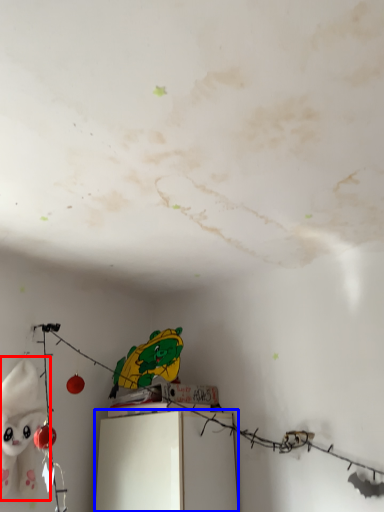
Question: Among these objects, which one is nearest to the camera, toy (highlighted by a red box) or furniture (highlighted by a blue box)?

Choices:
 (A) toy
 (B) furniture

Answer: (A)